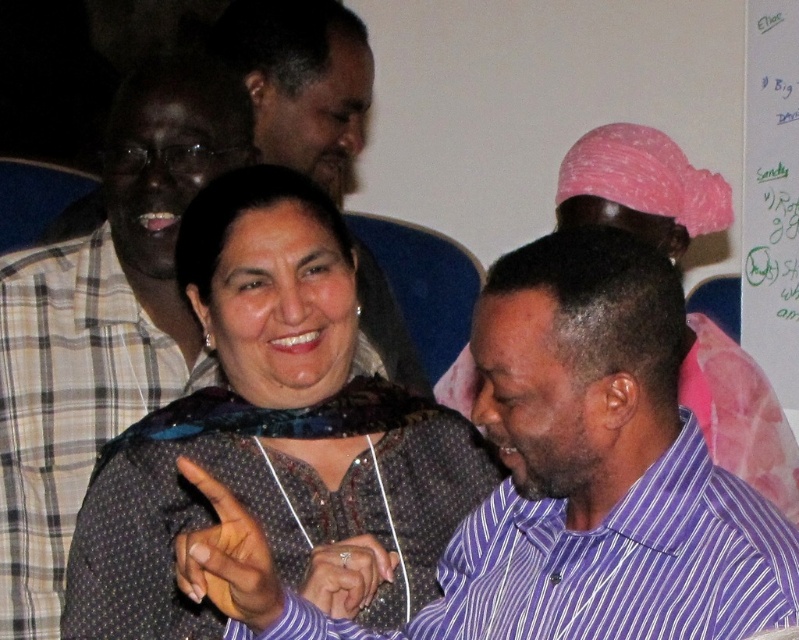
Between dark blue printed dress at center and purple striped shirt at lower right, which one has more height?

dark blue printed dress at center

Between dark blue printed dress at center and purple striped shirt at lower right, which one appears on the left side from the viewer's perspective?

dark blue printed dress at center

Between point (205, 323) and point (599, 550), which one is positioned in front?

Point (599, 550)

This screenshot has width=799, height=640. Find the location of `dark blue printed dress at center`. dark blue printed dress at center is located at coordinates (271, 428).

Consider the image. Is dark blue printed dress at center smaller than white paper at upper right?

No.

Measure the distance between dark blue printed dress at center and white paper at upper right.

dark blue printed dress at center is 4.62 feet from white paper at upper right.

Is point (209, 444) farther from viewer compared to point (784, 316)?

No, (209, 444) is closer to viewer.

The image size is (799, 640). I want to click on dark blue printed dress at center, so click(271, 428).

Does purple striped shirt at lower right appear over white paper at upper right?

No.

Locate an element on the screen. purple striped shirt at lower right is located at coordinates (602, 564).